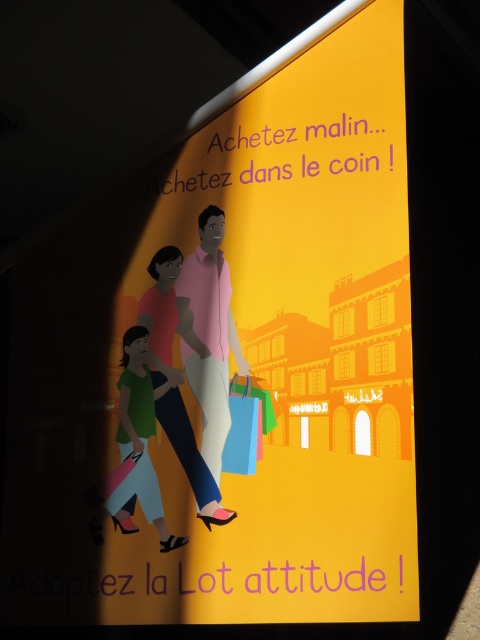
Question: Estimate the real-world distances between objects in this image. Which object is farther from the matte pink dress at center?

Choices:
 (A) green fabric shopping bag at center
 (B) pink matte shirt at center

Answer: (A)

Question: Does matte green fabric at lower left have a larger size compared to blue fabric shopping bag at center?

Choices:
 (A) yes
 (B) no

Answer: (A)

Question: Which of the following is the closest to the observer?

Choices:
 (A) matte green fabric at lower left
 (B) matte pink dress at center
 (C) blue fabric shopping bag at center
 (D) green fabric shopping bag at center

Answer: (B)

Question: Is pink matte shirt at center closer to the viewer compared to matte pink dress at center?

Choices:
 (A) yes
 (B) no

Answer: (B)

Question: Can you confirm if matte green fabric at lower left is positioned to the right of blue fabric shopping bag at center?

Choices:
 (A) yes
 (B) no

Answer: (B)

Question: Among these objects, which one is nearest to the camera?

Choices:
 (A) blue fabric shopping bag at center
 (B) pink matte shirt at center
 (C) matte green fabric at lower left

Answer: (C)